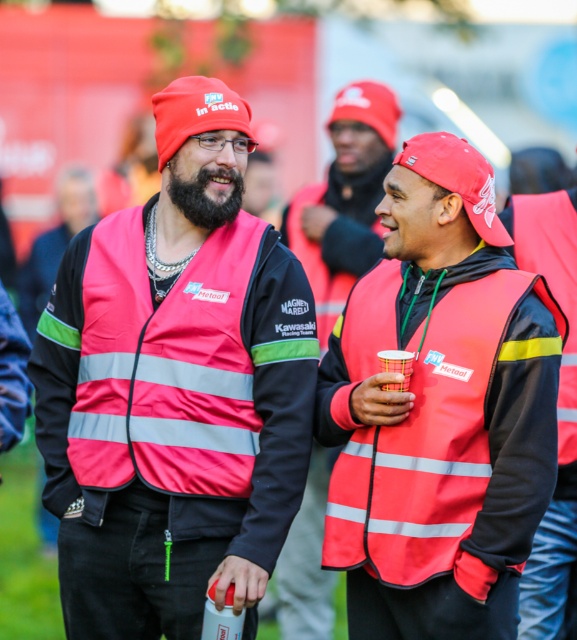
Question: Does reflective fabric safety vest at left have a lesser width compared to reflective red vest at center?

Choices:
 (A) yes
 (B) no

Answer: (B)

Question: Estimate the real-world distances between objects in this image. Which object is closer to the reflective fabric safety vest at left?

Choices:
 (A) matte pink vest at center
 (B) reflective red vest at center
 (C) reflective fabric safety vest at center
 (D) reflective fabric life jacket at center

Answer: (A)

Question: Which of the following is the closest to the observer?

Choices:
 (A) reflective fabric safety vest at left
 (B) reflective red vest at center

Answer: (A)

Question: Is reflective fabric safety vest at left above reflective red vest at center?

Choices:
 (A) no
 (B) yes

Answer: (A)

Question: Can you confirm if reflective fabric safety vest at left is positioned below reflective red vest at center?

Choices:
 (A) yes
 (B) no

Answer: (A)

Question: Which object is positioned farthest from the matte pink vest at center?

Choices:
 (A) reflective red vest at center
 (B) reflective fabric life jacket at center

Answer: (A)